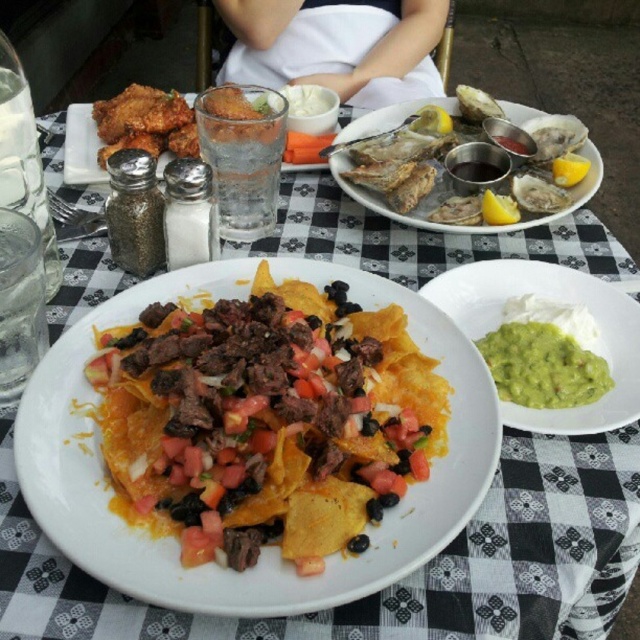
You are a food critic evaluating this meal. You notice the crunchy tortilla chips with cheese, meat, tomatoes, and black beans at center and the green creamy guacamole at right. Which of these two items is located below the other?

The crunchy tortilla chips with cheese, meat, tomatoes, and black beans at center is positioned under the green creamy guacamole at right.

You are at a dinner party and want to reach for the green creamy guacamole at right and the shiny silver oysters at upper right. Which one is located to the right of the other?

The green creamy guacamole at right is to the right of the shiny silver oysters at upper right.

You are at a party and want to grab a snack from the table. You see the crunchy tortilla chips with cheese, meat, tomatoes, and black beans at center and the green creamy guacamole at right. Which one is closer to your left side?

The crunchy tortilla chips with cheese, meat, tomatoes, and black beans at center is closer to your left side since it is positioned to the left of the green creamy guacamole at right.